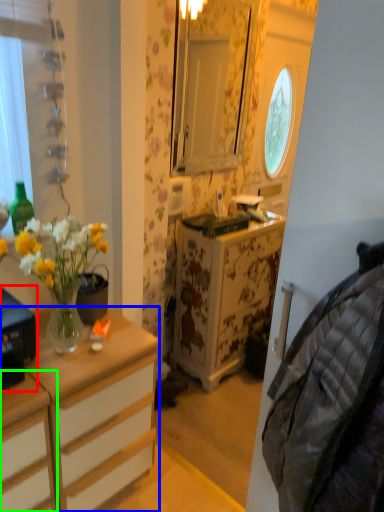
Question: Based on their relative distances, which object is farther from desk (highlighted by a red box)? Choose from cabinetry (highlighted by a blue box) and cabinetry (highlighted by a green box).

Choices:
 (A) cabinetry
 (B) cabinetry

Answer: (A)